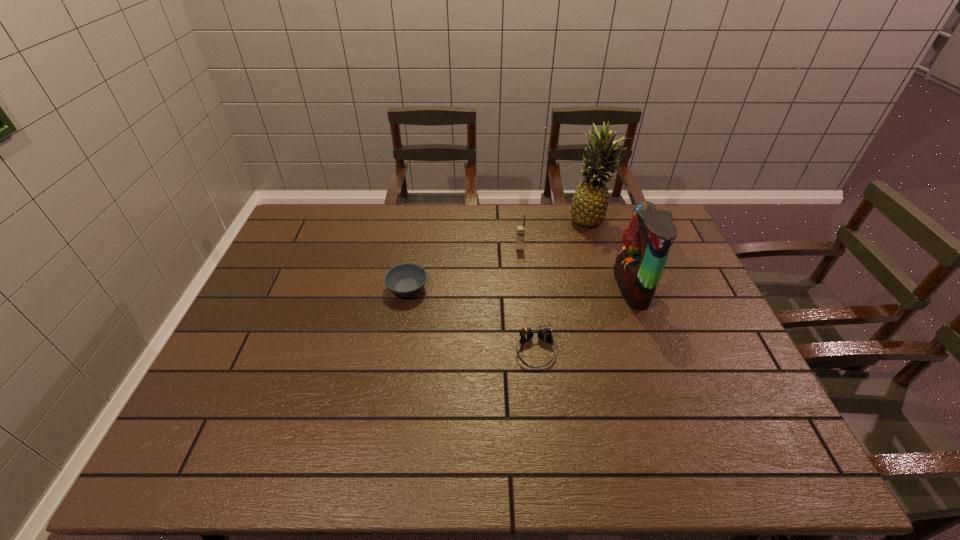
I want to click on pineapple, so click(589, 204).

You are a GUI agent. You are given a task and a screenshot of the screen. Output one action in this format:
    pyautogui.click(x=<x>, y=<y>)
    Task: Click on the farthest object
    
    Given the screenshot: What is the action you would take?
    pyautogui.click(x=589, y=204)

Find the location of a particular element. parrot is located at coordinates click(x=639, y=265).

The width and height of the screenshot is (960, 540). In order to click on the third shortest object in this screenshot , I will do `click(520, 229)`.

This screenshot has width=960, height=540. I want to click on the fourth nearest object, so click(x=520, y=229).

In order to click on the leftmost object in this screenshot , I will do `click(407, 279)`.

Find the location of a particular element. The height and width of the screenshot is (540, 960). the nearest object is located at coordinates (544, 334).

Image resolution: width=960 pixels, height=540 pixels. Identify the location of free space located on the left of the tallest object. (504, 219).

Where is `vacant space situated at the face of the parrot`? This screenshot has height=540, width=960. vacant space situated at the face of the parrot is located at coordinates (554, 287).

This screenshot has height=540, width=960. Identify the location of free space located 0.180m at the face of the parrot. (557, 287).